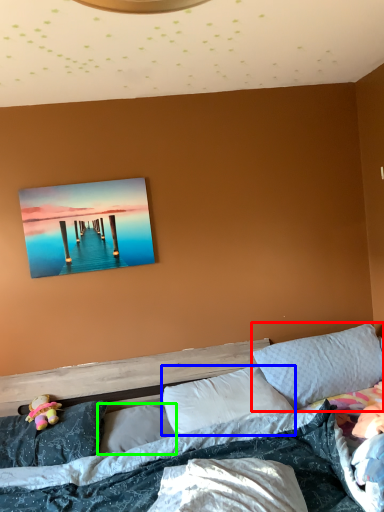
Question: Which object is positioned closest to pillow (highlighted by a red box)? Select from pillow (highlighted by a blue box) and pillow (highlighted by a green box).

Choices:
 (A) pillow
 (B) pillow

Answer: (A)